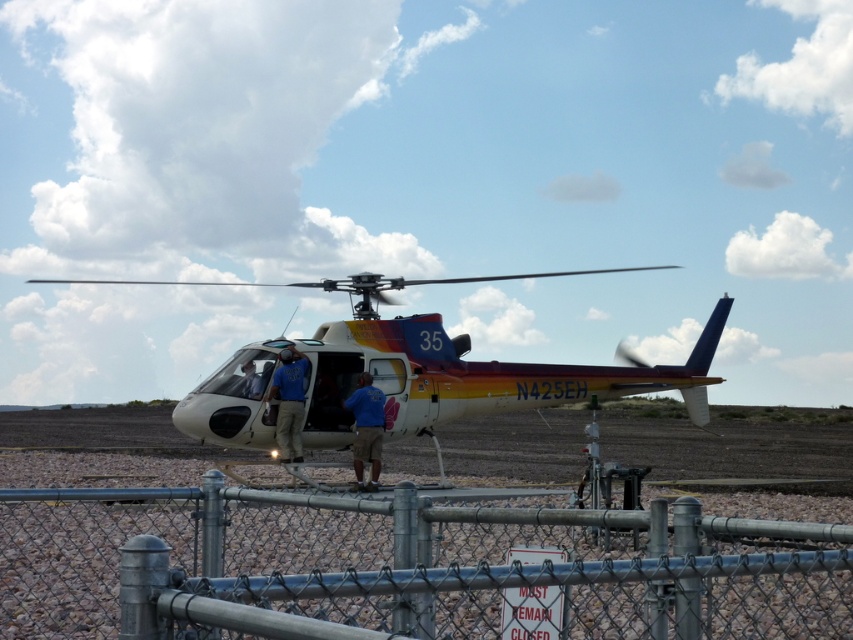
You are a photographer trying to capture the two points marked in the scene. Which point, point (277, 378) or point (248, 396), appears closer to you in the image?

Point (248, 396) appears closer to you because it is closer to the camera than point (277, 378).